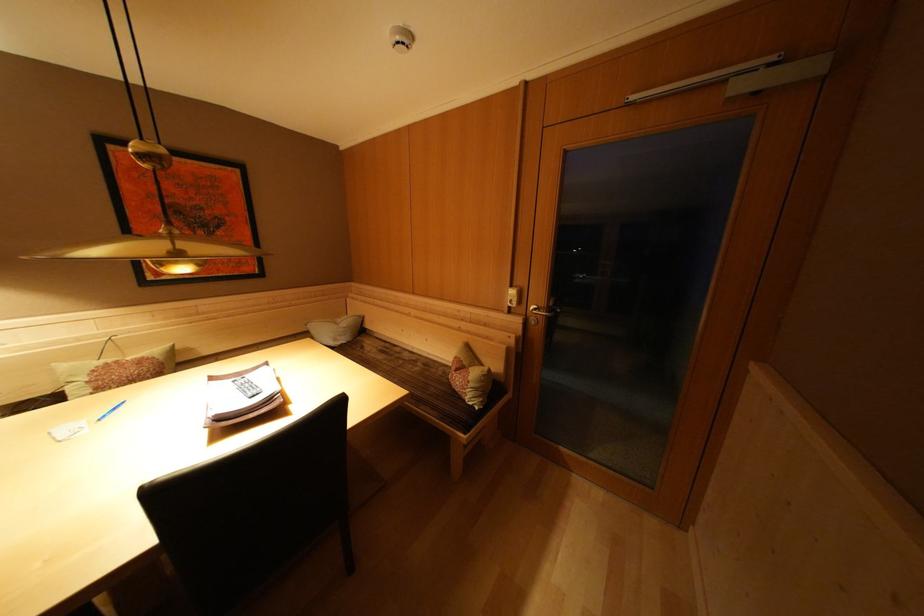
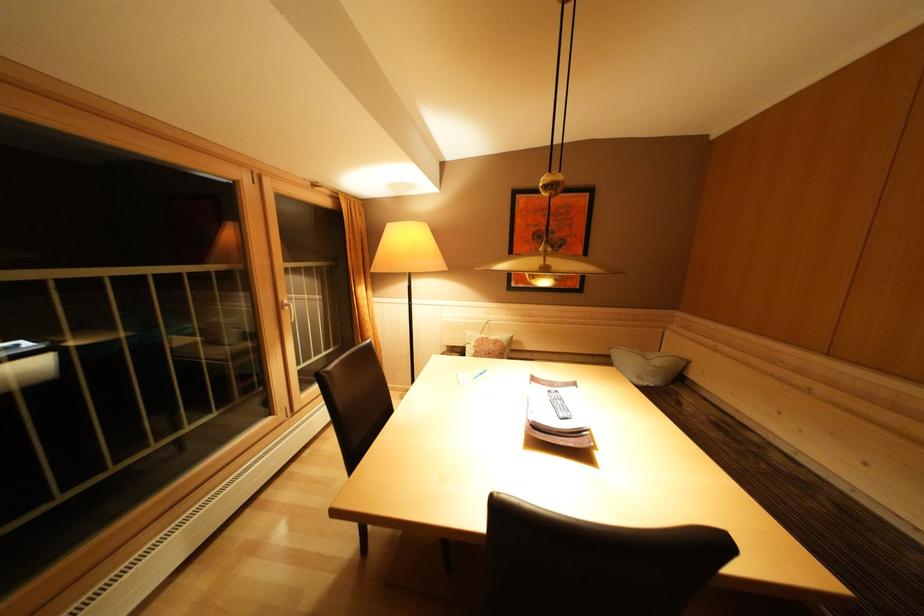
Question: How did the camera likely rotate?

Choices:
 (A) Left
 (B) Right
 (C) Up
 (D) Down

Answer: (A)